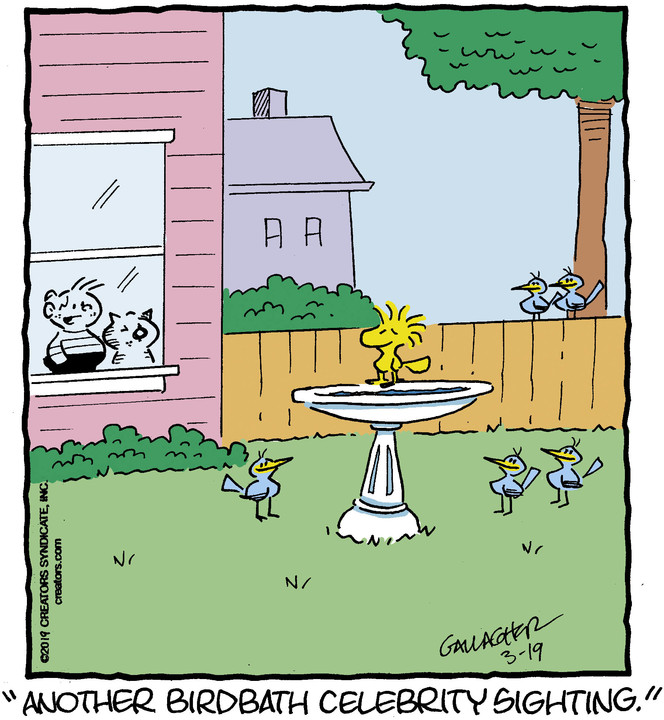
The image size is (664, 720). What are the coordinates of `window` in the screenshot? It's located at (127, 286).